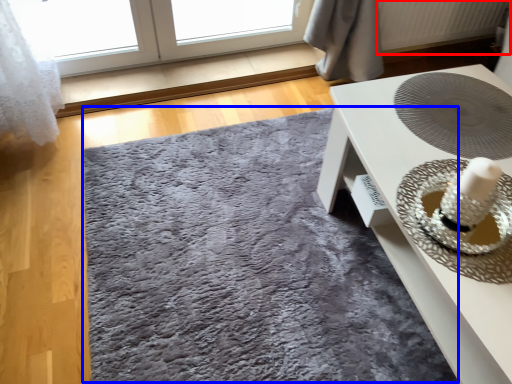
Question: Which point is further to the camera, radiator (highlighted by a red box) or mat (highlighted by a blue box)?

Choices:
 (A) radiator
 (B) mat

Answer: (A)